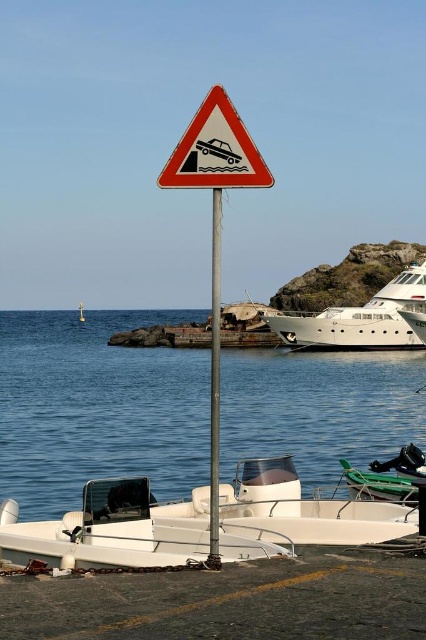
Is blue water at lower center thinner than orange reflective triangle at center?

No, blue water at lower center is not thinner than orange reflective triangle at center.

Can you confirm if blue water at lower center is smaller than orange reflective triangle at center?

No.

The image size is (426, 640). I want to click on blue water at lower center, so click(97, 406).

Where is `blue water at lower center`? This screenshot has height=640, width=426. blue water at lower center is located at coordinates (97, 406).

Can you confirm if white matte boat at lower center is positioned below metallic pole at center?

Correct, white matte boat at lower center is located below metallic pole at center.

Image resolution: width=426 pixels, height=640 pixels. What are the coordinates of `white matte boat at lower center` in the screenshot? It's located at (106, 531).

The height and width of the screenshot is (640, 426). What do you see at coordinates (106, 531) in the screenshot?
I see `white matte boat at lower center` at bounding box center [106, 531].

Identify the location of white matte boat at lower center. The height and width of the screenshot is (640, 426). (106, 531).

How much distance is there between blue water at lower center and white glossy yacht at right?

blue water at lower center and white glossy yacht at right are 10.24 meters apart from each other.

Does blue water at lower center have a greater height compared to white glossy yacht at right?

Yes, blue water at lower center is taller than white glossy yacht at right.

Does point (236, 401) lie behind point (374, 304)?

No.

Image resolution: width=426 pixels, height=640 pixels. Identify the location of blue water at lower center. (97, 406).